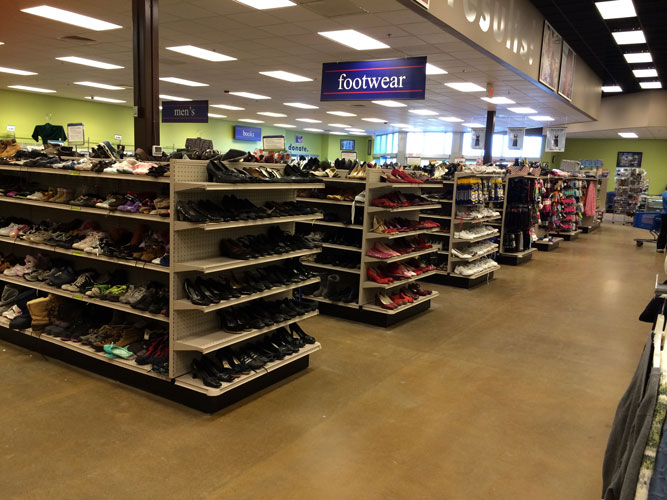
The height and width of the screenshot is (500, 667). I want to click on display, so click(629, 187).